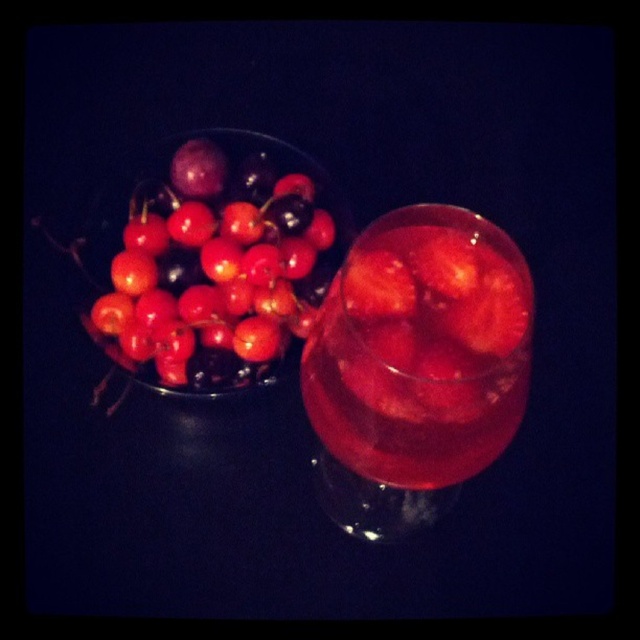
Is translucent glass at center wider than shiny red cherries at upper left?

No, translucent glass at center is not wider than shiny red cherries at upper left.

This screenshot has width=640, height=640. I want to click on translucent glass at center, so 417,365.